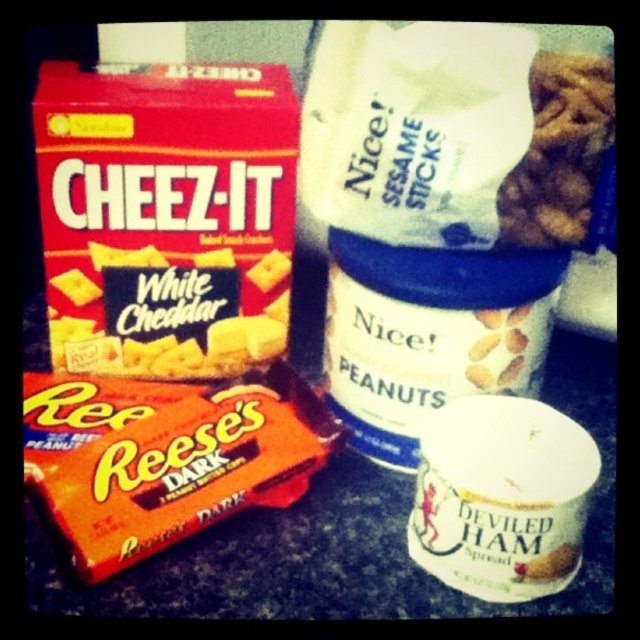
Based on the photo, you are trying to place both the orange wrapper chocolate at center and the white cheddar cheese at upper left into a rectangular container. Which item should you place first to ensure both fit?

You should place the white cheddar cheese at upper left first because the orange wrapper chocolate at center might be wider, so placing the wider item later allows better adjustment for space.